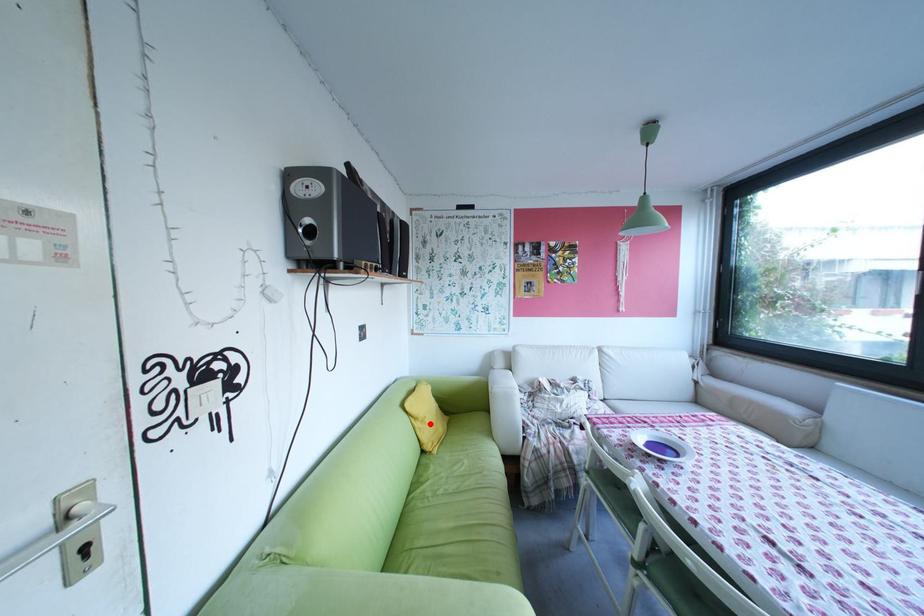
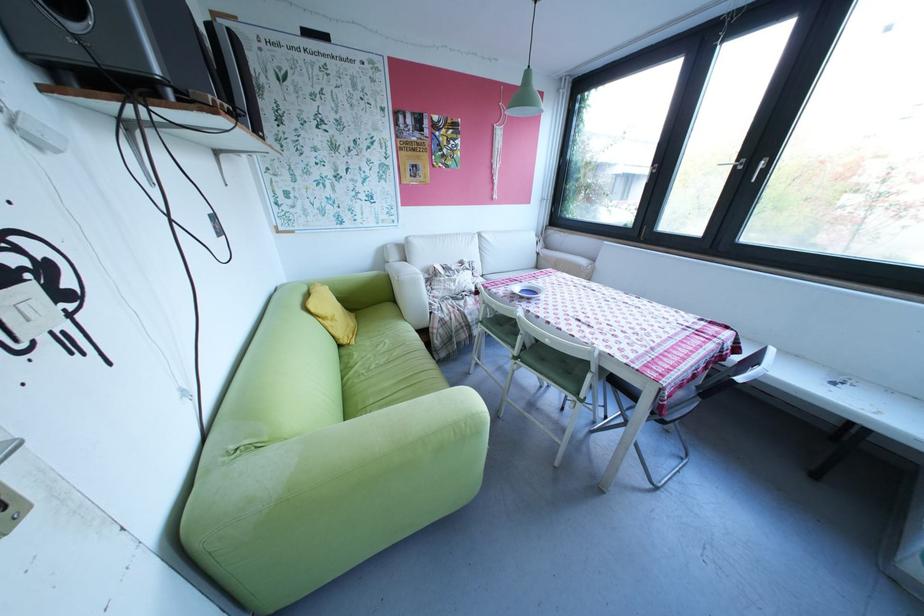
Question: A red point is marked in image1. In image2, is the corresponding 3D point closer to the camera or farther? Reply with the corresponding letter.

Choices:
 (A) The corresponding 3D point is closer.
 (B) The corresponding 3D point is farther.

Answer: (A)